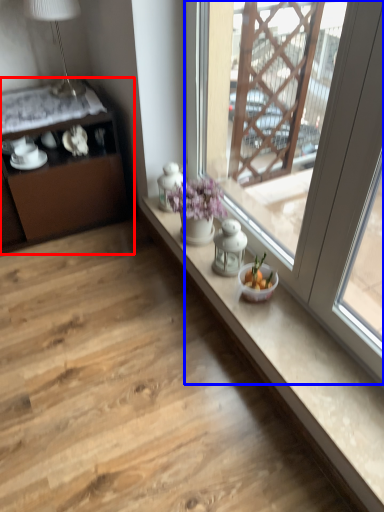
Question: Which object appears closest to the camera in this image, cabinetry (highlighted by a red box) or window (highlighted by a blue box)?

Choices:
 (A) cabinetry
 (B) window

Answer: (B)